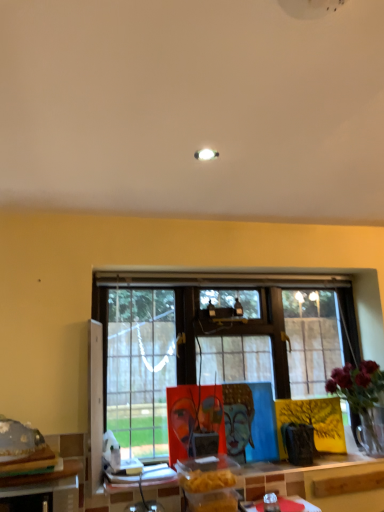
The image size is (384, 512). I want to click on free space underneath green leafy plant at right (from a real-world perspective), so click(x=365, y=458).